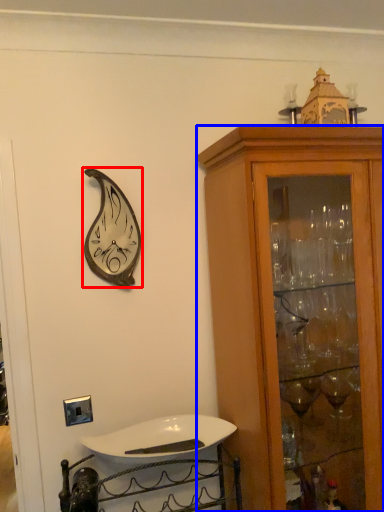
Question: Which object appears farthest to the camera in this image, clock (highlighted by a red box) or cabinetry (highlighted by a blue box)?

Choices:
 (A) clock
 (B) cabinetry

Answer: (A)